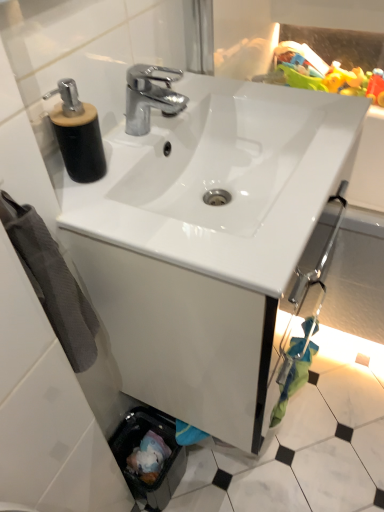
Question: From the image's perspective, is white glossy sink at center positioned above or below black matte soap dispenser at upper left?

Choices:
 (A) below
 (B) above

Answer: (A)

Question: Considering the positions of white glossy sink at center and black matte soap dispenser at upper left in the image, is white glossy sink at center wider or thinner than black matte soap dispenser at upper left?

Choices:
 (A) thin
 (B) wide

Answer: (B)

Question: Estimate the real-world distances between objects in this image. Which object is farther from the plastic green toy at upper right?

Choices:
 (A) gray cotton towel at left
 (B) white glossy sink at center
 (C) black matte soap dispenser at upper left

Answer: (A)

Question: Which object is positioned closest to the gray cotton towel at left?

Choices:
 (A) plastic green toy at upper right
 (B) black matte soap dispenser at upper left
 (C) white glossy sink at center

Answer: (B)